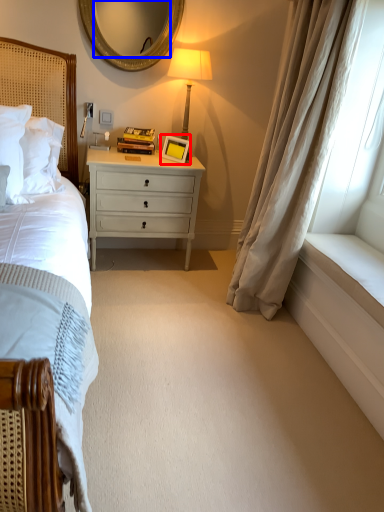
Question: Among these objects, which one is farthest to the camera, picture frame (highlighted by a red box) or mirror (highlighted by a blue box)?

Choices:
 (A) picture frame
 (B) mirror

Answer: (A)